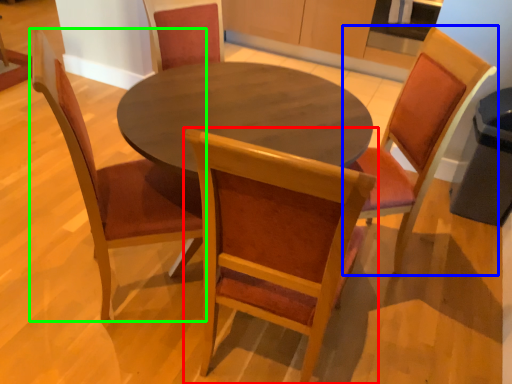
Question: Estimate the real-world distances between objects in this image. Which object is closer to chair (highlighted by a red box), chair (highlighted by a blue box) or chair (highlighted by a green box)?

Choices:
 (A) chair
 (B) chair

Answer: (B)